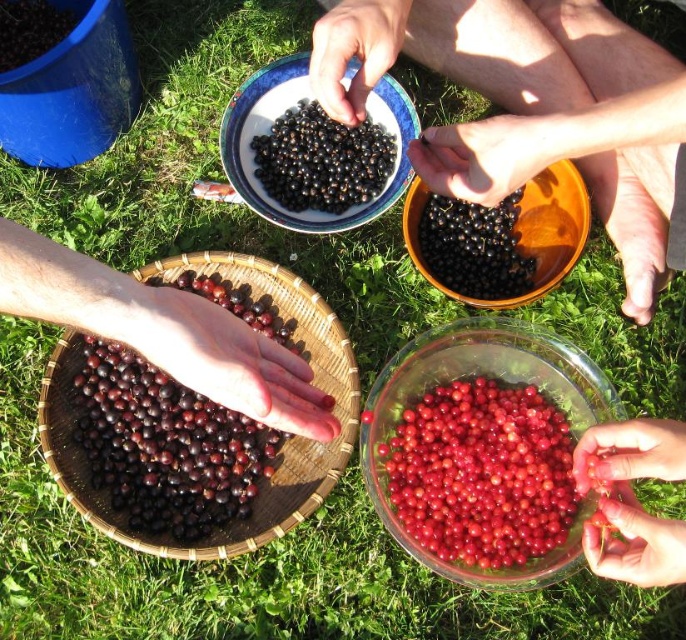
Question: Does shiny dark purple berries at center have a greater width compared to black matte currant at center?

Choices:
 (A) yes
 (B) no

Answer: (A)

Question: Among these points, which one is nearest to the camera?

Choices:
 (A) (370, 164)
 (B) (495, 390)

Answer: (B)

Question: Can you confirm if smooth black berries at center is positioned to the left of shiny dark purple berries at center?

Choices:
 (A) yes
 (B) no

Answer: (B)

Question: Which of the following is the farthest from the observer?

Choices:
 (A) shiny dark purple berries at center
 (B) black matte berries at center
 (C) matte ceramic bowl at center
 (D) smooth black bowl at upper center

Answer: (B)

Question: Observing the image, what is the correct spatial positioning of smooth black berries at center in reference to shiny red berries at center?

Choices:
 (A) above
 (B) below

Answer: (A)

Question: Which point is closer to the camera?

Choices:
 (A) (514, 144)
 (B) (233, 440)

Answer: (A)